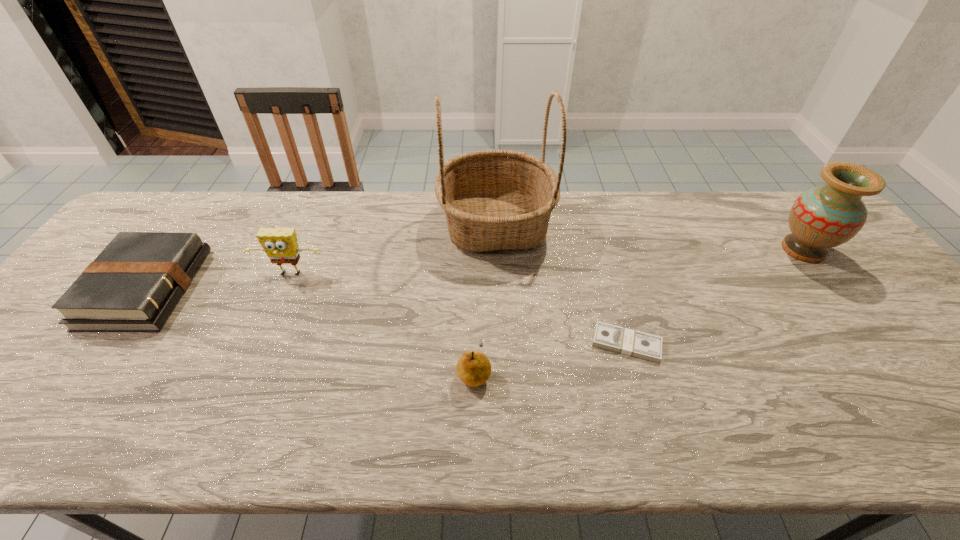
The image size is (960, 540). Find the location of `basket`. basket is located at coordinates (493, 199).

Identify the location of the rightmost object. [822, 217].

Find the location of a particular element. This screenshot has height=540, width=960. vase is located at coordinates (822, 217).

Find the location of `the third tallest object`. the third tallest object is located at coordinates [280, 244].

Where is `the fifth object from right to left`? This screenshot has height=540, width=960. the fifth object from right to left is located at coordinates (280, 244).

Where is `the third shortest object`? the third shortest object is located at coordinates (473, 368).

What are the coordinates of `the leftmost object` in the screenshot? It's located at (133, 285).

At what (x,y) coordinates should I click in order to perform the action: click on hardback book. Please return your answer as a coordinate pair (x, y). Image resolution: width=960 pixels, height=540 pixels. Looking at the image, I should click on (133, 285).

Locate an element on the screen. the fifth object from left to right is located at coordinates (622, 340).

Image resolution: width=960 pixels, height=540 pixels. Find the location of `dollar`. dollar is located at coordinates (622, 340).